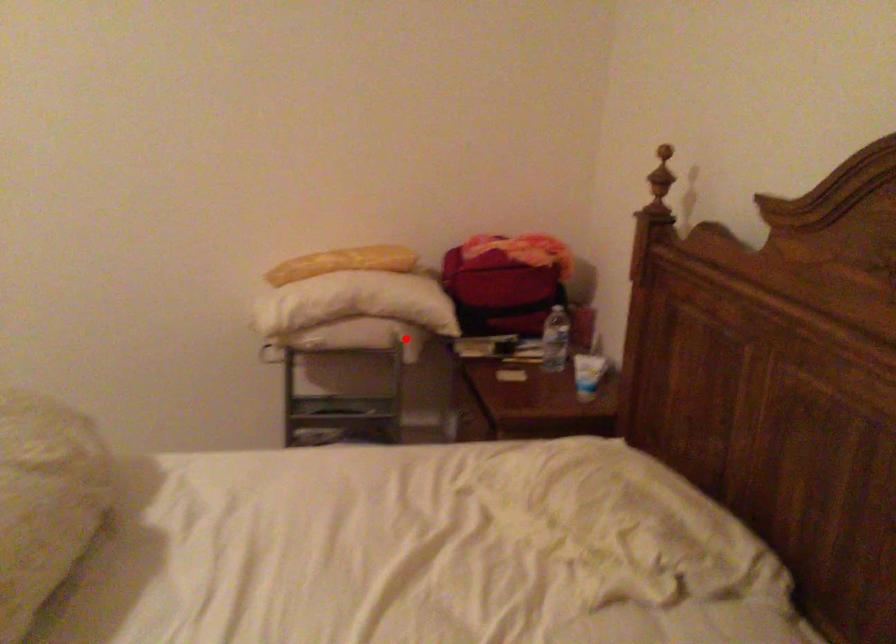
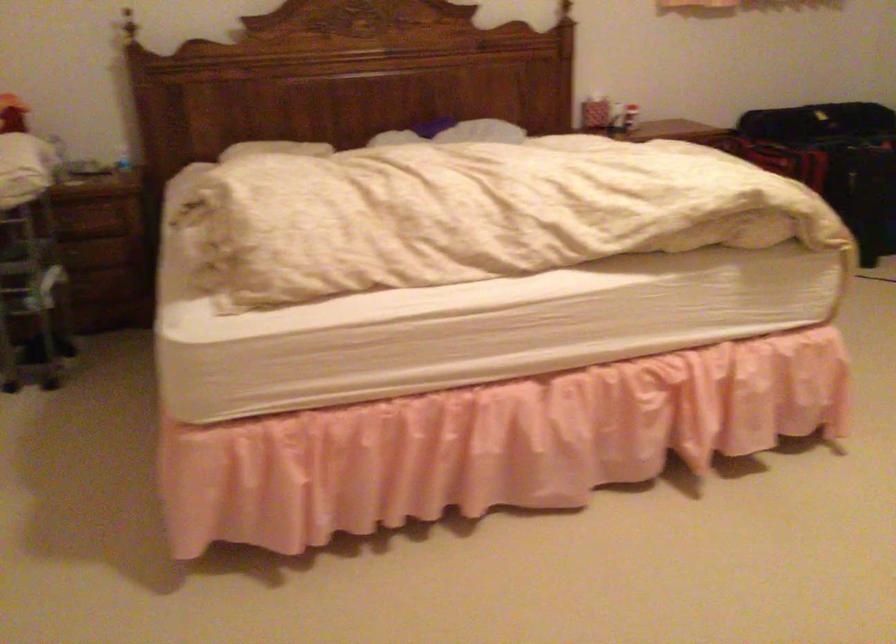
Locate, in the second image, the point that corresponds to the highlighted location in the first image.

(59, 158)